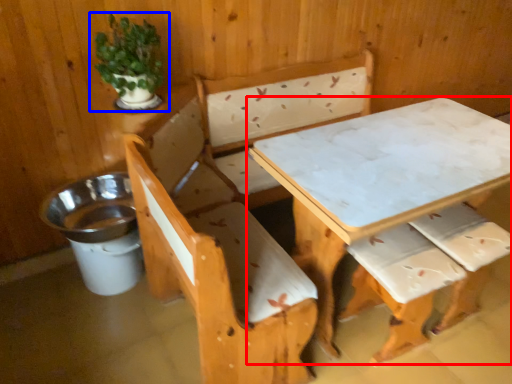
Question: Among these objects, which one is farthest to the camera, table (highlighted by a red box) or houseplant (highlighted by a blue box)?

Choices:
 (A) table
 (B) houseplant

Answer: (B)